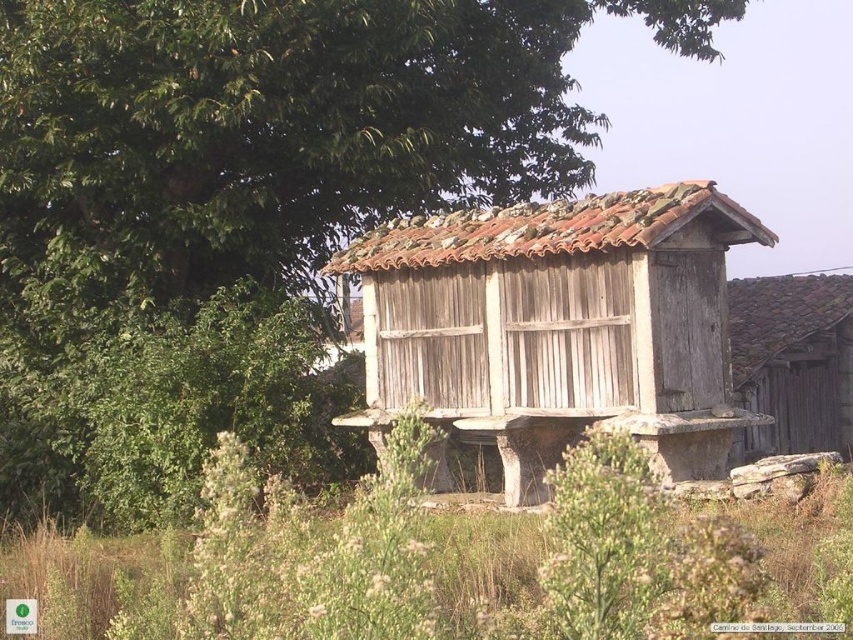
You are standing in the rural area looking at the green leafy tree at upper left and the weathered wood hut at center. Which object is higher in the image?

The green leafy tree at upper left is above the weathered wood hut at center, so it is higher in the image.

You are standing in the rural area and want to take a photo of the weathered wood hut at center. However, the green leafy tree at upper left is blocking your view. Can you move to the right to get a clear shot?

The green leafy tree at upper left is further to the viewer than the weathered wood hut at center, so moving to the right might help you position yourself around the tree to get an unobstructed view of the weathered wood hut at center.